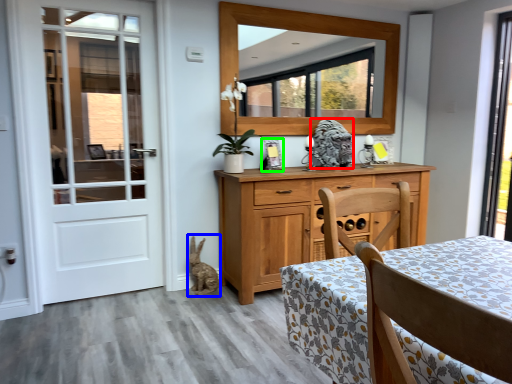
Question: Which object is the farthest from animal (highlighted by a red box)? Choose among these: animal (highlighted by a blue box) or picture frame (highlighted by a green box).

Choices:
 (A) animal
 (B) picture frame

Answer: (A)